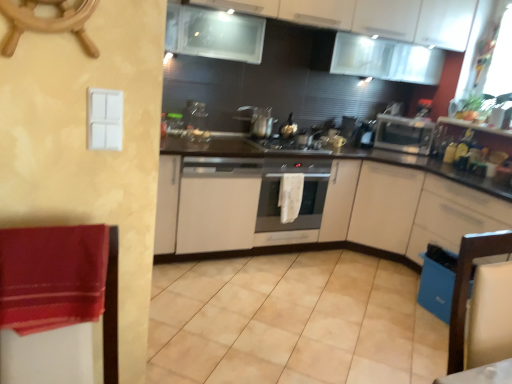
Question: In terms of size, does satin silver pot at center appear bigger or smaller than beige tile at center?

Choices:
 (A) big
 (B) small

Answer: (B)

Question: Is satin silver pot at center spatially inside beige tile at center, or outside of it?

Choices:
 (A) outside
 (B) inside

Answer: (A)

Question: Considering the real-world distances, which object is farthest from the wooden ship's wheel at upper left?

Choices:
 (A) blue plastic dishwasher at lower right
 (B) satin silver pot at center
 (C) wooden chair at lower right
 (D) beige tile at center
 (E) white matte cabinet at center, the second cabinetry positioned from the top

Answer: (A)

Question: Estimate the real-world distances between objects in this image. Which object is farther from the velvet red blanket at left?

Choices:
 (A) satin silver pot at center
 (B) wooden chair at lower right
 (C) white matte cabinet at center, the second cabinetry positioned from the top
 (D) white matte cabinet at center, marked as the 2th cabinetry in a bottom-to-top arrangement
 (E) white matte cabinet at center, acting as the fourth cabinetry starting from the top

Answer: (E)